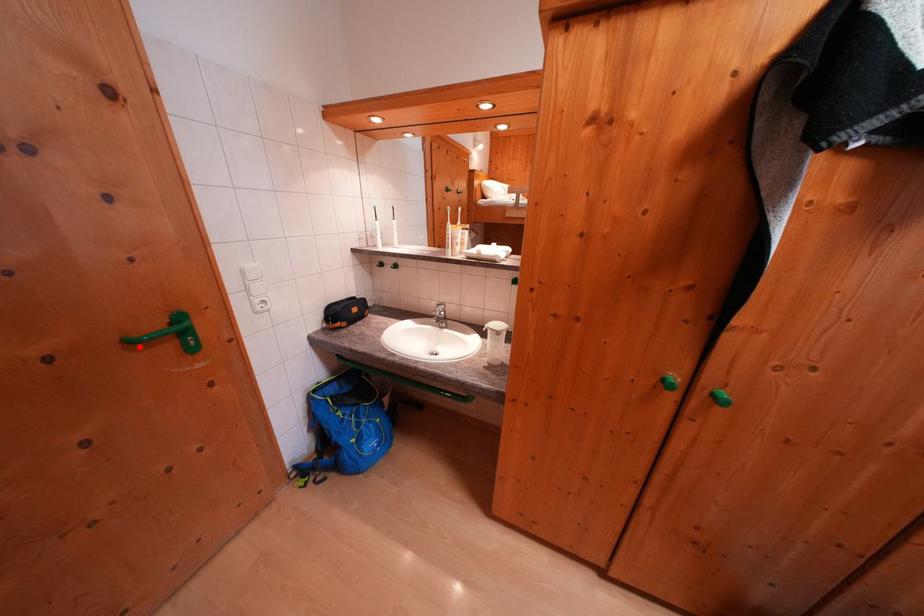
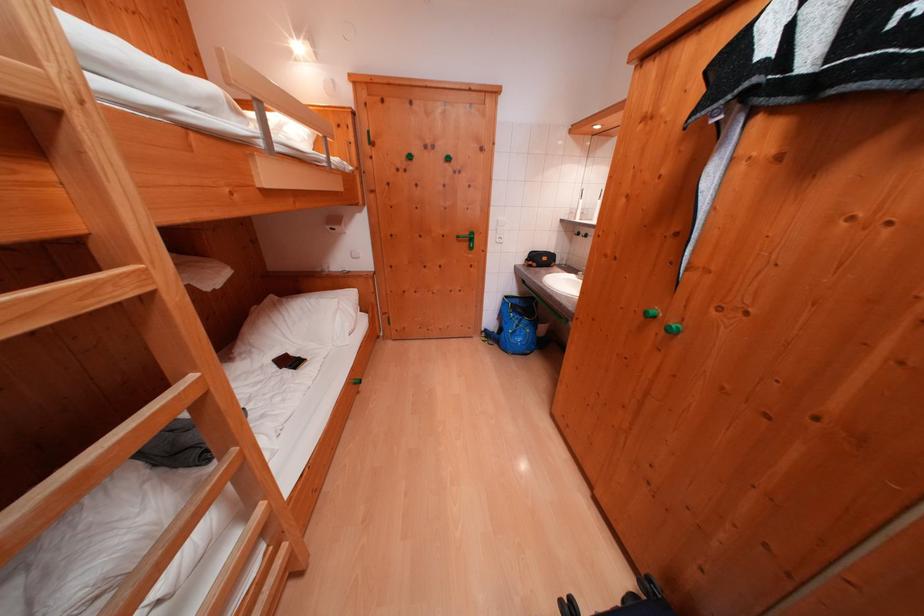
Question: I am providing you with two images of the same scene from different viewpoints. A red point is marked on the first image. At the location where the point appears in image 1, is it still visible in image 2?

Choices:
 (A) Yes
 (B) No

Answer: (A)